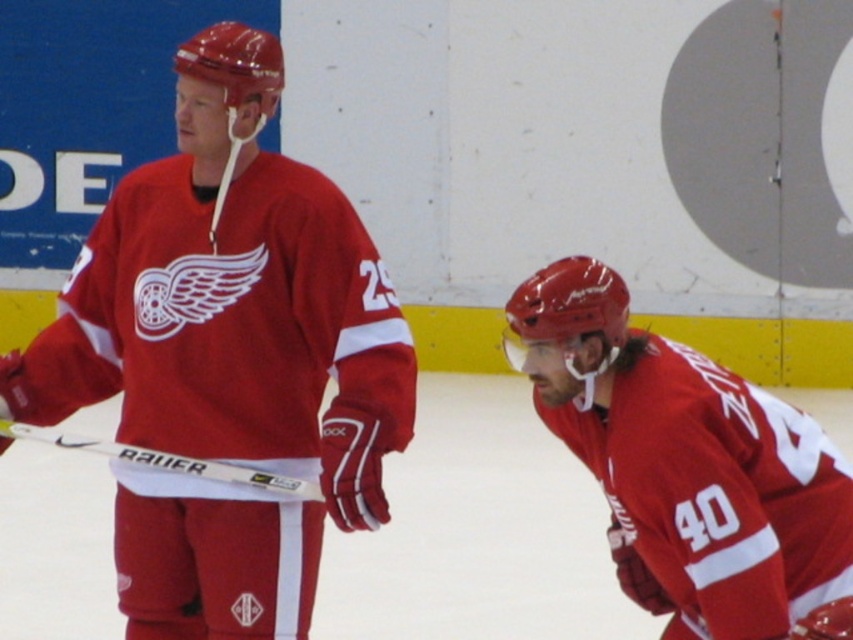
Who is higher up, matte jersey at center or matte red jersey at lower right?

Positioned higher is matte jersey at center.

Between matte jersey at center and matte red jersey at lower right, which one has less height?

Standing shorter between the two is matte red jersey at lower right.

Which is in front, point (247, 36) or point (761, 570)?

Point (761, 570) is more forward.

Locate an element on the screen. This screenshot has width=853, height=640. matte jersey at center is located at coordinates (227, 356).

Is matte red jersey at lower right behind white matte hockey stick at left?

No, matte red jersey at lower right is closer to the viewer.

Who is taller, matte red jersey at lower right or white matte hockey stick at left?

matte red jersey at lower right is taller.

Image resolution: width=853 pixels, height=640 pixels. What are the coordinates of `matte red jersey at lower right` in the screenshot? It's located at (683, 461).

Is matte jersey at center positioned at the back of white matte hockey stick at left?

No, it is in front of white matte hockey stick at left.

Is point (105, 256) less distant than point (314, 492)?

No, it is not.

Where is `matte jersey at center`? The width and height of the screenshot is (853, 640). matte jersey at center is located at coordinates (227, 356).